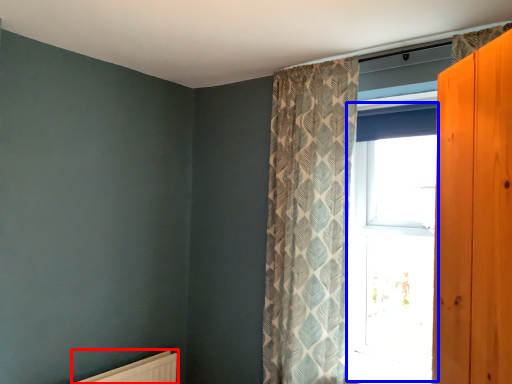
Question: Which object appears closest to the camera in this image, radiator (highlighted by a red box) or window (highlighted by a blue box)?

Choices:
 (A) radiator
 (B) window

Answer: (A)